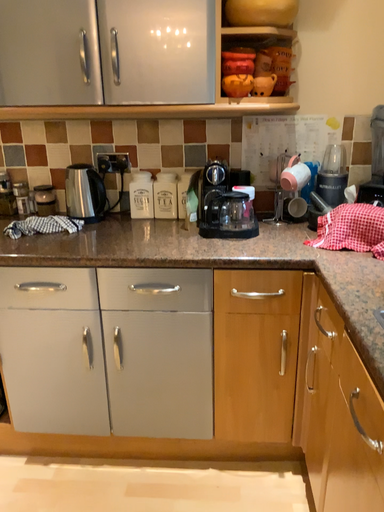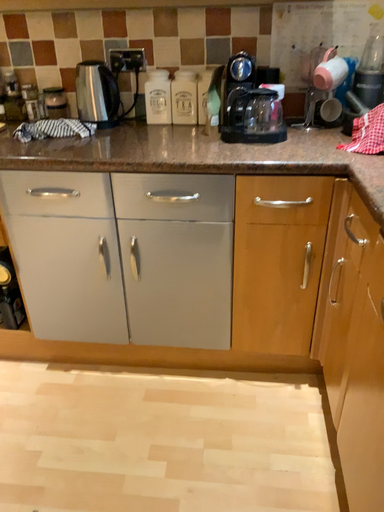
Question: Which way did the camera rotate in the video?

Choices:
 (A) rotated downward
 (B) rotated upward

Answer: (A)